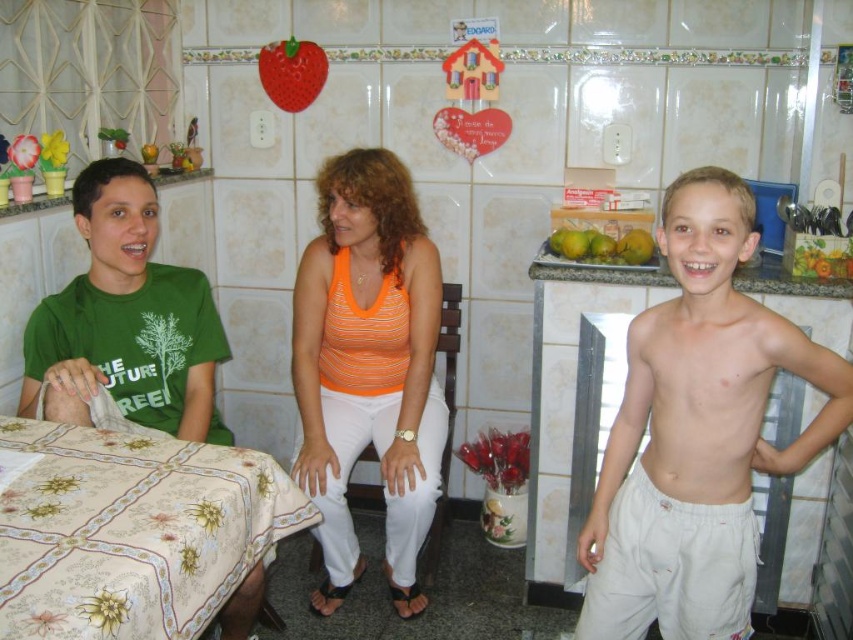
Based on the photo, does light beige cotton shorts at right have a lesser width compared to orange striped tank top at center?

No.

Who is more forward, [759,365] or [386,208]?

Point [759,365] is more forward.

At what (x,y) coordinates should I click in order to perform the action: click on light beige cotton shorts at right. Please return your answer as a coordinate pair (x, y). Looking at the image, I should click on (697, 433).

From the picture: Is floral-patterned fabric at left thinner than green matte t-shirt at left?

No, floral-patterned fabric at left is not thinner than green matte t-shirt at left.

Between point (50, 468) and point (207, 314), which one is positioned in front?

Point (50, 468) is more forward.

The width and height of the screenshot is (853, 640). What are the coordinates of `floral-patterned fabric at left` in the screenshot? It's located at (132, 531).

You are a GUI agent. You are given a task and a screenshot of the screen. Output one action in this format:
    pyautogui.click(x=<x>, y=<y>)
    Task: Click on the floral-patterned fabric at left
    The height and width of the screenshot is (640, 853).
    Given the screenshot: What is the action you would take?
    pyautogui.click(x=132, y=531)

Can you confirm if green matte t-shirt at left is thinner than rubber strawberry at upper center?

Incorrect, green matte t-shirt at left's width is not less than rubber strawberry at upper center's.

In the scene shown: Who is more forward, (206, 355) or (294, 51)?

Point (206, 355) is in front.

Find the location of a particular element. green matte t-shirt at left is located at coordinates (126, 321).